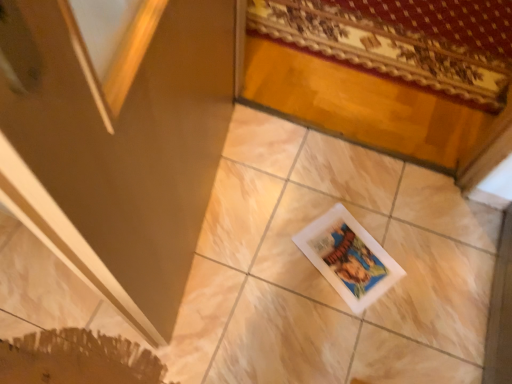
Image resolution: width=512 pixels, height=384 pixels. Identify the location of unoccupied region to the right of white matte picture frame at center. (420, 269).